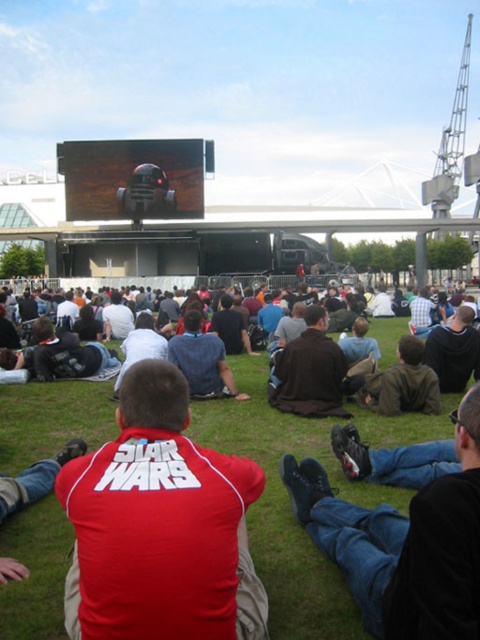
You are a photographer standing at the edge of the crowd. You want to take a photo that includes both the green grass at center and the dark brown jacket at center. Which object should you focus on first to ensure both are in sharp focus?

The green grass at center is closer to the viewer than the dark brown jacket at center. To ensure both are in sharp focus, focus on the green grass at center first since it is closer, and the jacket will be within the depth of field.